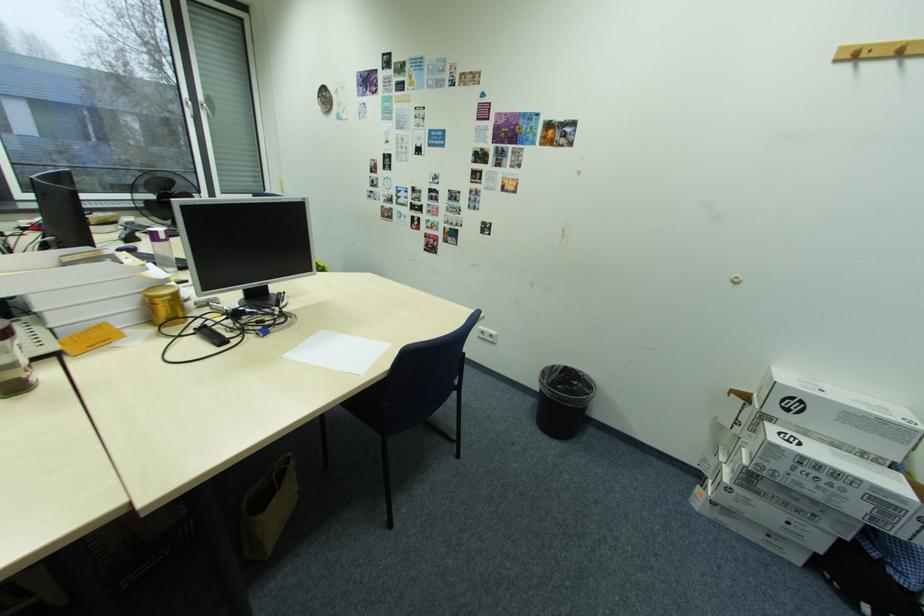
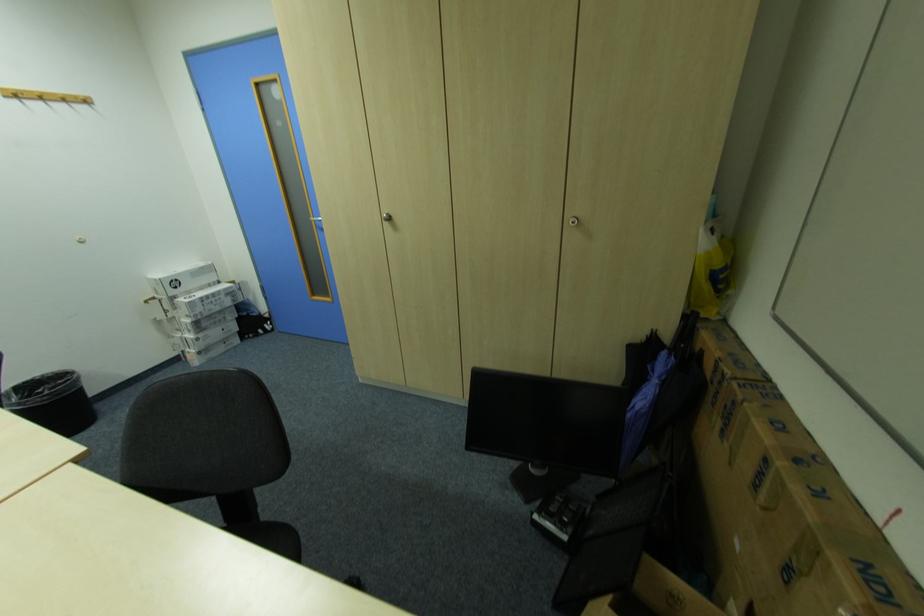
Where in the second image is the point corresponding to (x=584, y=384) from the first image?

(49, 391)